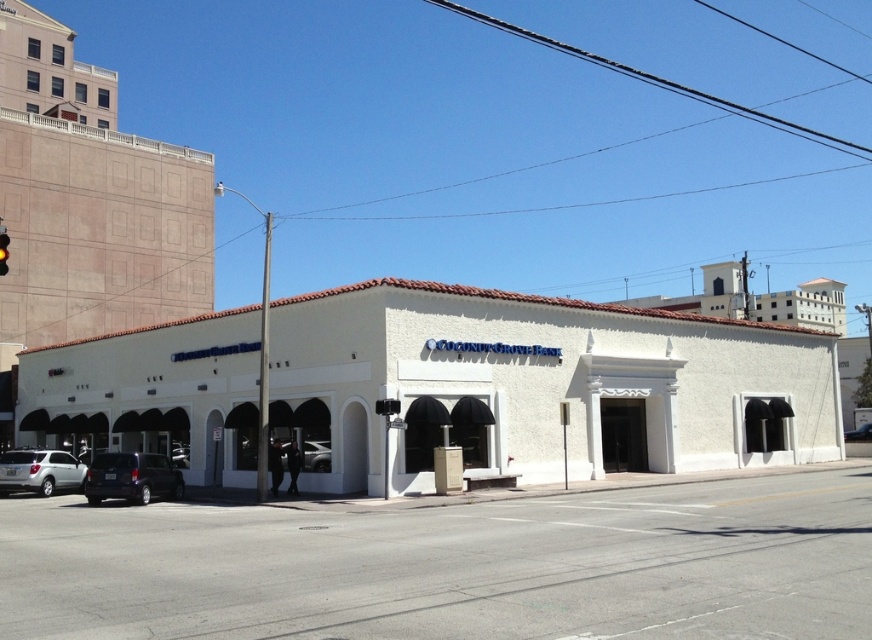
You are standing at the point marked by the coordinate point (452, 566) on the lower center of the image. You want to walk towards the Coconut Grove Bank entrance. Is the entrance to the Coconut Grove Bank located to your left or right side?

The entrance to the Coconut Grove Bank is located to your right side because the point (452, 566) represents the white concrete street at lower center, and the bank entrance is positioned to the right of this central point.

You are standing on the sidewalk in front of the Coconut Grove Bank building. You notice two points marked on the ground in front of you. The first point is at coordinates point (0, 240), and the second point is at point (848, 433). Which of these points is closer to you?

Point (0, 240) is closer to the viewer than point (848, 433).

You are a delivery driver approaching the Coconut Grove Bank. You need to park your matte black suv at center on the white concrete street at lower center. Can you drive your vehicle onto the street from the current position?

The white concrete street at lower center is to the left of matte black suv at center, so yes, you can drive the matte black suv at center onto the white concrete street at lower center since it is positioned to its right.